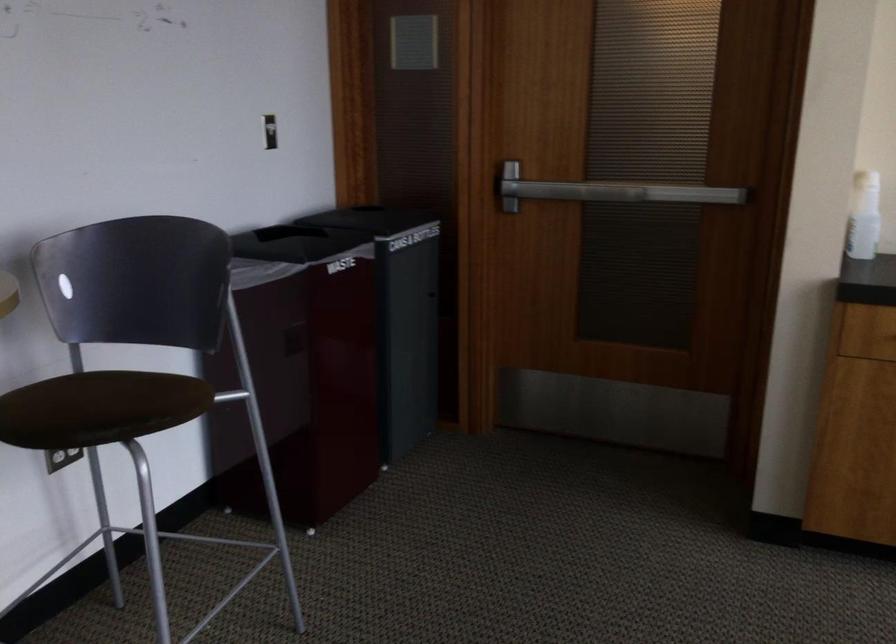
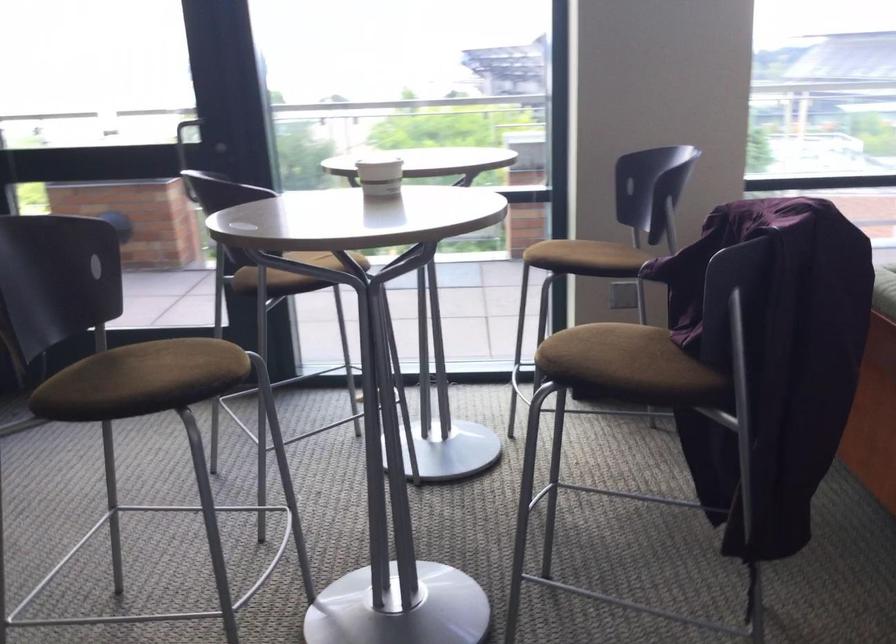
The first image is from the beginning of the video and the second image is from the end. How did the camera likely rotate when shooting the video?

The rotation direction of the camera is right-down.